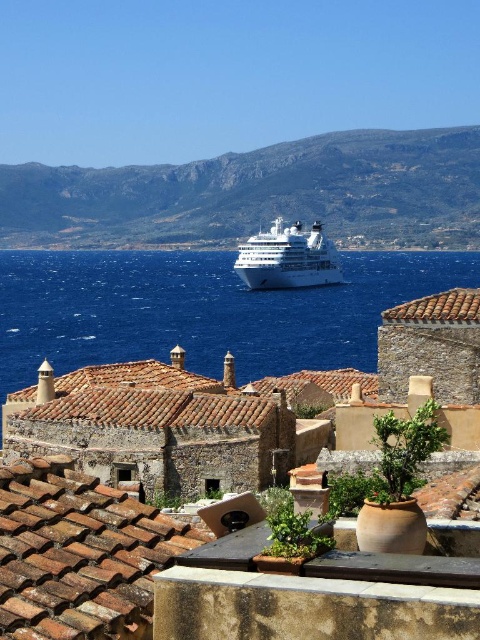
Question: Does blue liquid water at center appear over white glossy cruise ship at center?

Choices:
 (A) no
 (B) yes

Answer: (A)

Question: Is blue liquid water at center thinner than white glossy cruise ship at center?

Choices:
 (A) no
 (B) yes

Answer: (A)

Question: Which object appears closest to the camera in this image?

Choices:
 (A) blue liquid water at center
 (B) white glossy cruise ship at center

Answer: (A)

Question: Can you confirm if blue liquid water at center is positioned below white glossy cruise ship at center?

Choices:
 (A) yes
 (B) no

Answer: (A)

Question: Which of the following is the farthest from the observer?

Choices:
 (A) white glossy cruise ship at center
 (B) blue liquid water at center

Answer: (A)

Question: Which point is closer to the camera?

Choices:
 (A) blue liquid water at center
 (B) white glossy cruise ship at center

Answer: (A)